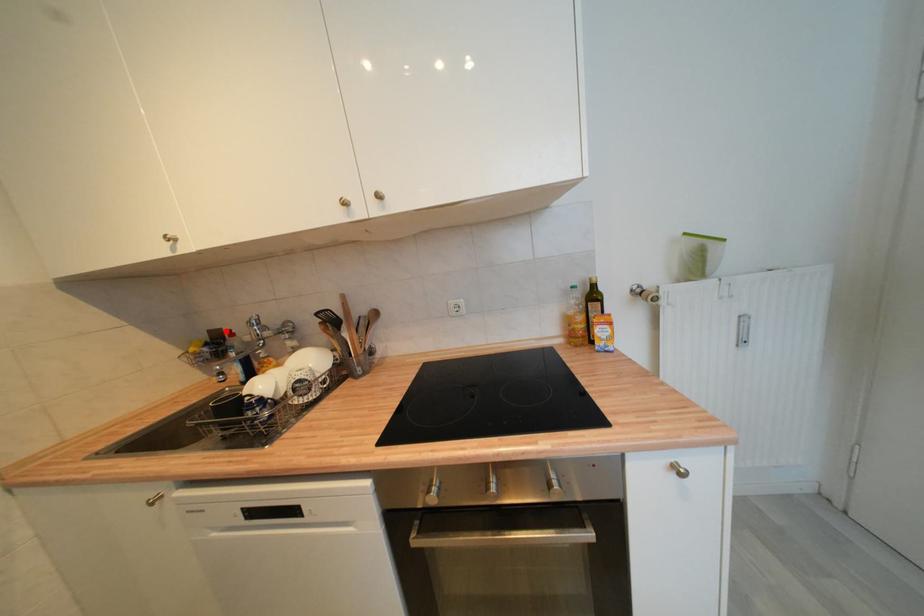
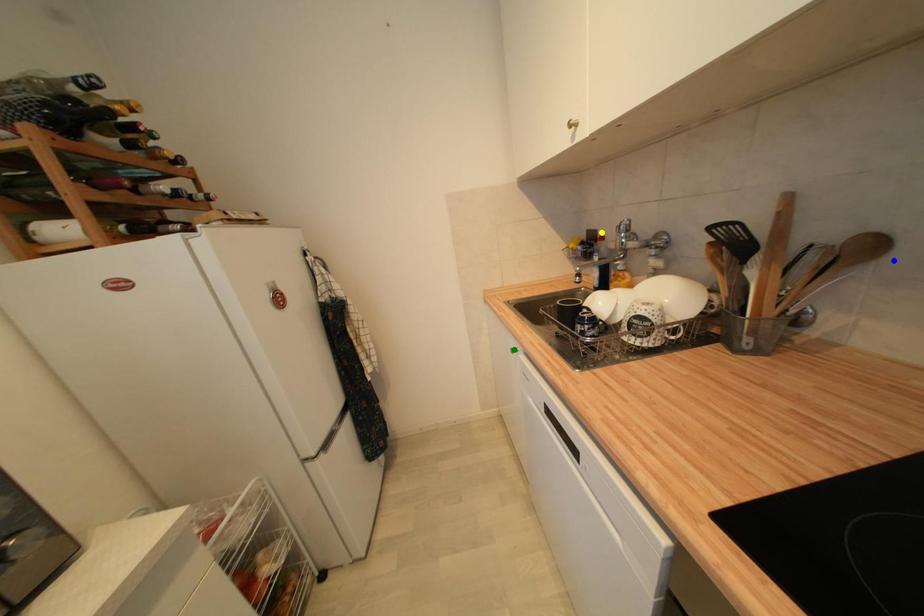
Question: I am providing you with two images of the same scene from different viewpoints. A red point is marked on the first image. You are given multiple points on the second image. In image 2, which mark is for the same physical point as the one in image 1?

Choices:
 (A) green point
 (B) blue point
 (C) yellow point

Answer: (C)